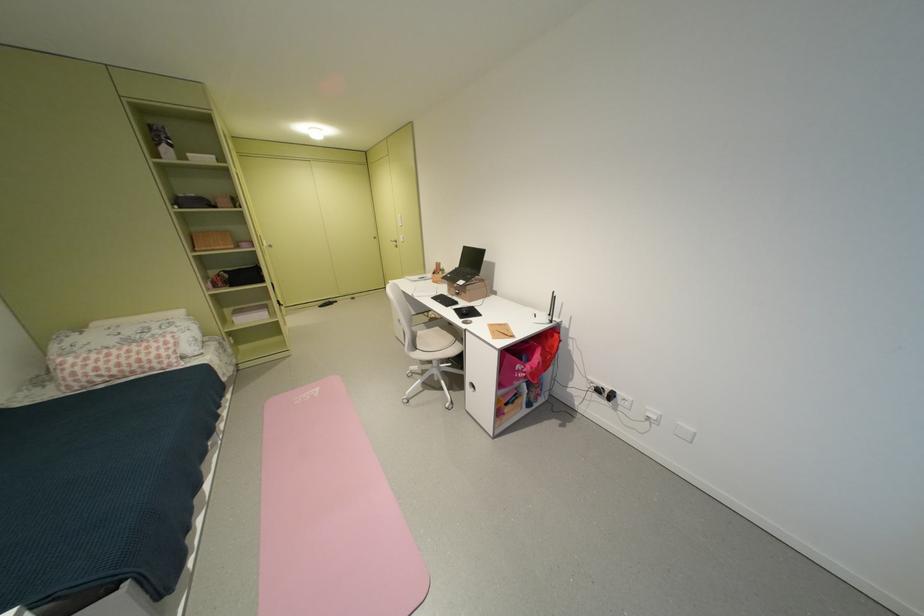
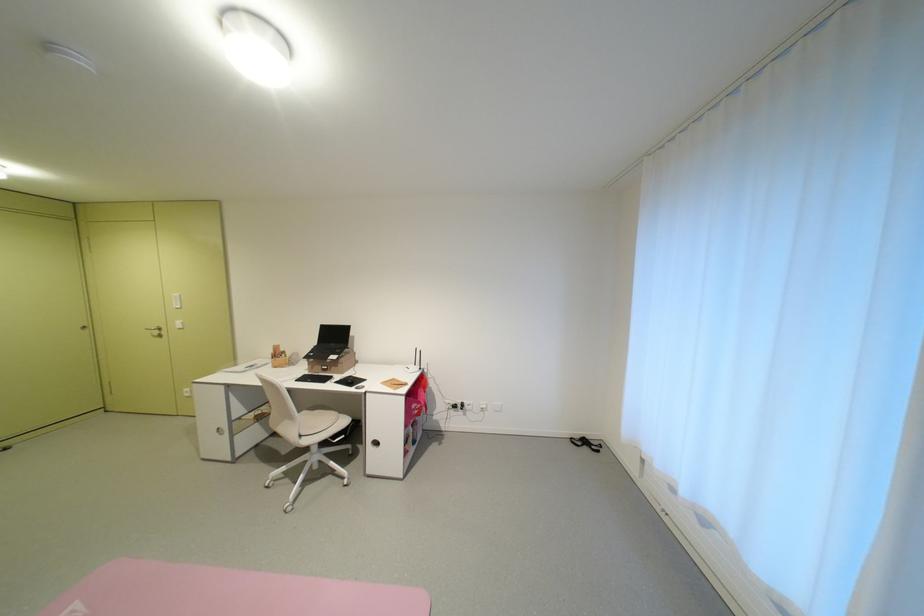
The point at (450, 274) is marked in the first image. Where is the corresponding point in the second image?

(293, 357)